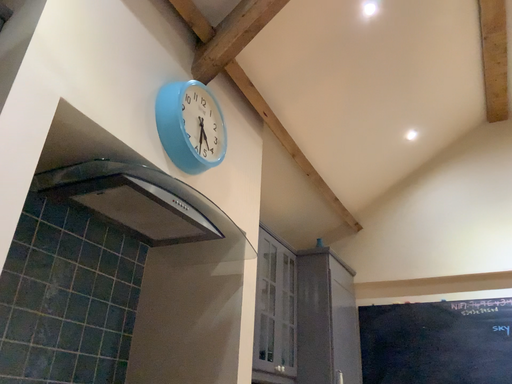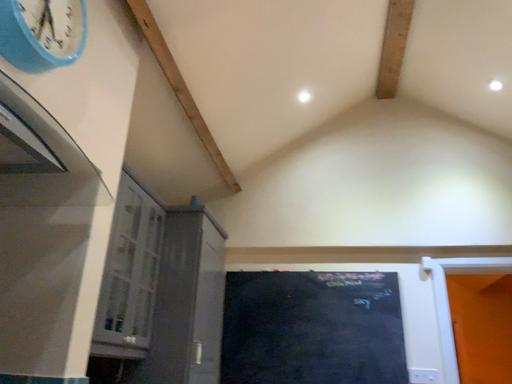
Question: How did the camera likely rotate when shooting the video?

Choices:
 (A) rotated left
 (B) rotated right

Answer: (B)